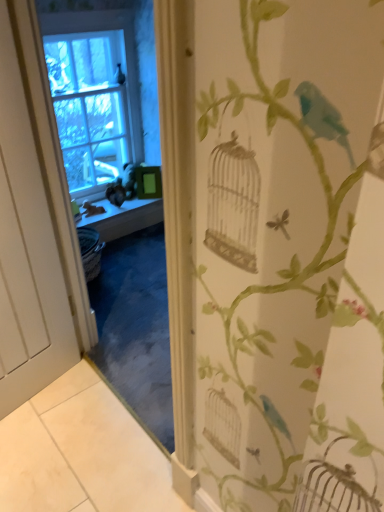
Question: Does point (97, 103) appear closer or farther from the camera than point (104, 215)?

Choices:
 (A) farther
 (B) closer

Answer: (A)

Question: Would you say clear glass window at upper left is to the left or to the right of smooth wooden window sill at center in the picture?

Choices:
 (A) right
 (B) left

Answer: (B)

Question: Considering the real-world distances, which object is closest to the clear glass window at upper left?

Choices:
 (A) white matte door at left
 (B) smooth wooden window sill at center

Answer: (B)

Question: Estimate the real-world distances between objects in this image. Which object is farther from the white matte door at left?

Choices:
 (A) smooth wooden window sill at center
 (B) clear glass window at upper left

Answer: (B)